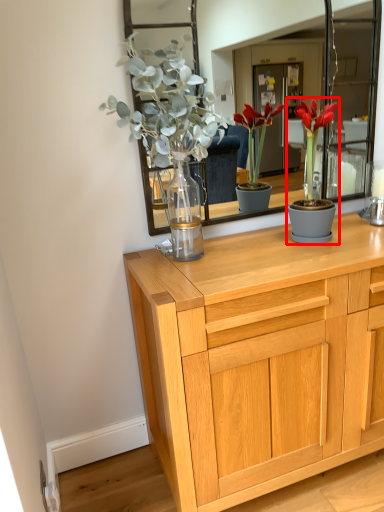
Question: Where is houseplant (annotated by the red box) located in relation to chest of drawers in the image?

Choices:
 (A) right
 (B) left

Answer: (A)